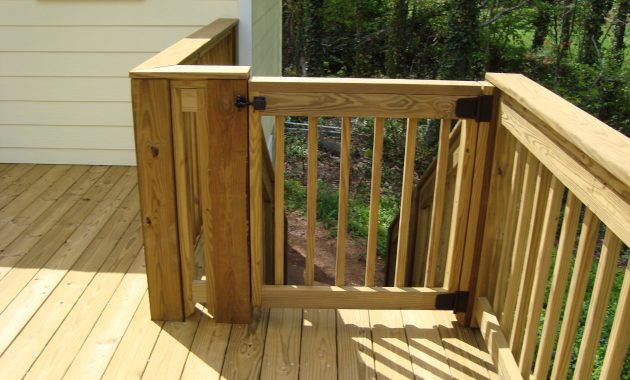
The height and width of the screenshot is (380, 630). I want to click on lock, so click(x=255, y=107).